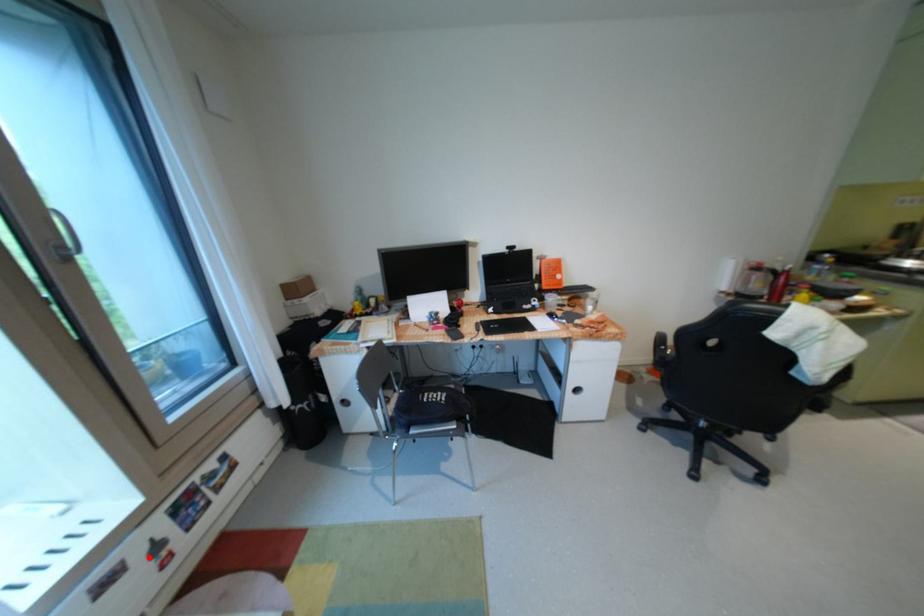
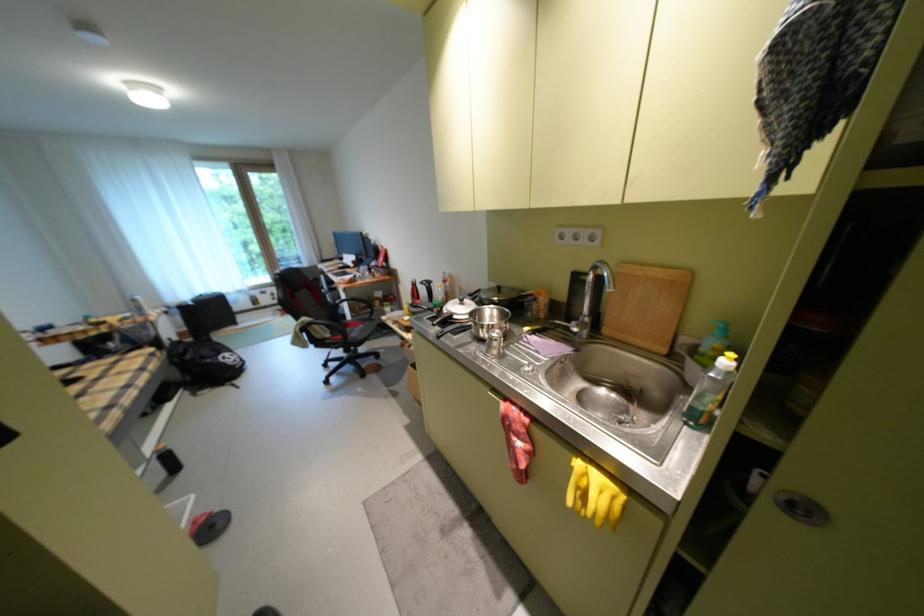
The point at the highlighted location is marked in the first image. Where is the corresponding point in the second image?

(280, 294)